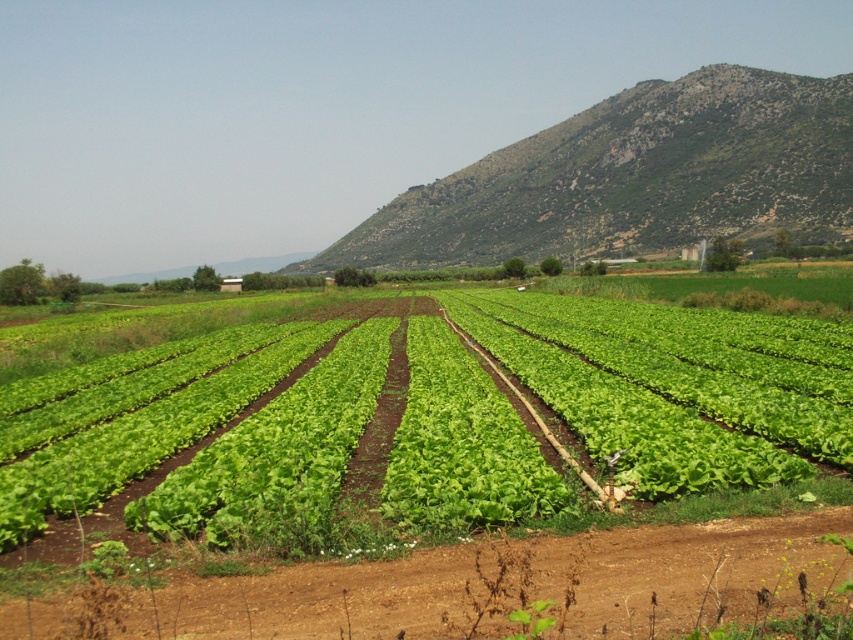
Is point (614, 445) positioned behind point (824, 90)?

No, it is in front of (824, 90).

The image size is (853, 640). What do you see at coordinates (668, 387) in the screenshot? I see `green leafy vegetable at center` at bounding box center [668, 387].

The width and height of the screenshot is (853, 640). I want to click on green leafy vegetable at center, so click(668, 387).

The width and height of the screenshot is (853, 640). Identify the location of green leafy vegetable at center. (668, 387).